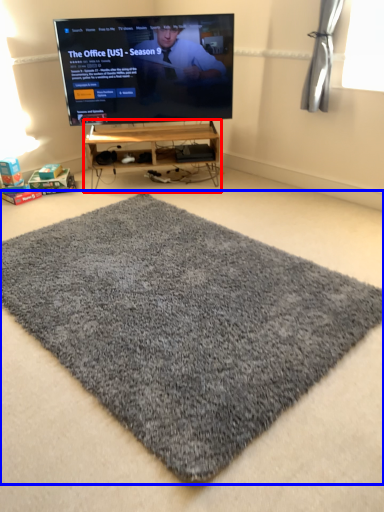
Question: Among these objects, which one is nearest to the camera, furniture (highlighted by a red box) or mat (highlighted by a blue box)?

Choices:
 (A) furniture
 (B) mat

Answer: (B)